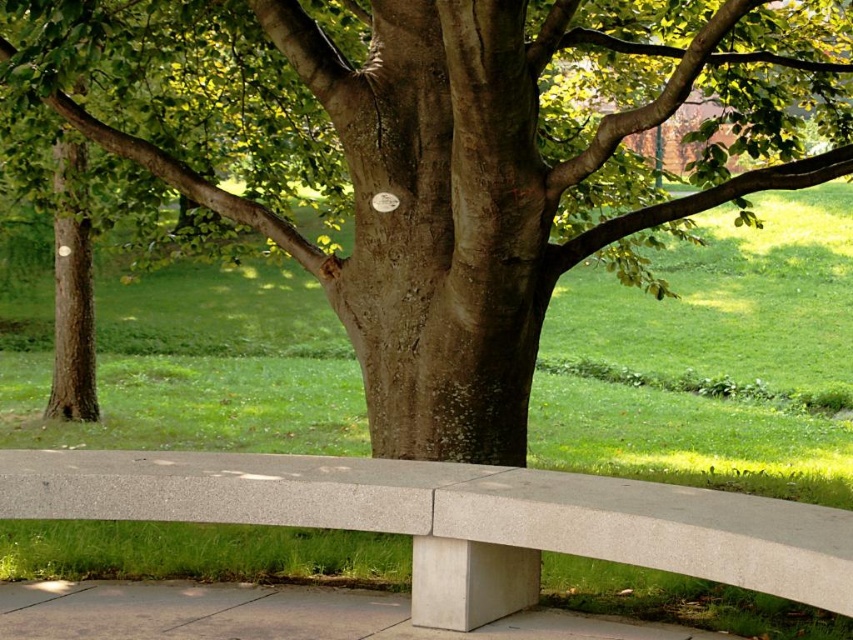
Question: Which of the following is the closest to the observer?

Choices:
 (A) smooth gray bench at center
 (B) gray concrete bench at lower center
 (C) smooth brown tree trunk at center

Answer: (A)

Question: Which point is farther to the camera?

Choices:
 (A) smooth gray bench at center
 (B) gray concrete bench at lower center

Answer: (B)

Question: Among these objects, which one is nearest to the camera?

Choices:
 (A) smooth gray bench at center
 (B) gray concrete bench at lower center

Answer: (A)

Question: Does smooth brown tree trunk at center appear over smooth gray bench at center?

Choices:
 (A) yes
 (B) no

Answer: (A)

Question: Does smooth gray bench at center have a smaller size compared to gray concrete bench at lower center?

Choices:
 (A) no
 (B) yes

Answer: (A)

Question: Is smooth gray bench at center below gray concrete bench at lower center?

Choices:
 (A) yes
 (B) no

Answer: (B)